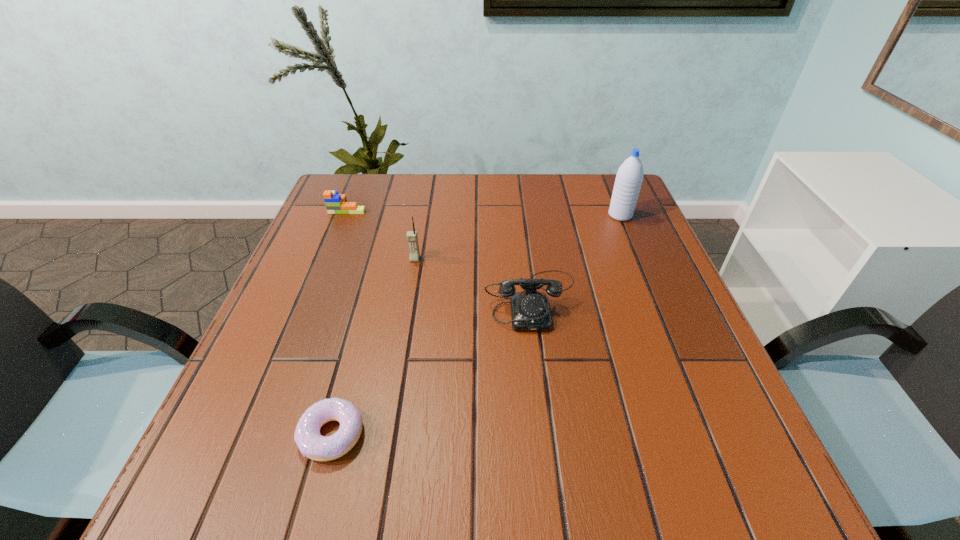
At what (x,y) coordinates should I click in order to perform the action: click on vacant space located on the left of the tallest object. Please return your answer as a coordinate pair (x, y). The image size is (960, 540). Looking at the image, I should click on (539, 215).

Identify the location of free point located on the front of the third nearest object, where the keypad is located. (392, 393).

Locate an element on the screen. This screenshot has height=540, width=960. vacant space located on the front-facing side of the third tallest object is located at coordinates (543, 403).

Where is `vacant region located on the front of the Lego`? The image size is (960, 540). vacant region located on the front of the Lego is located at coordinates (314, 293).

Where is `free space located 0.200m on the back of the second object from left to right`? The image size is (960, 540). free space located 0.200m on the back of the second object from left to right is located at coordinates (362, 321).

The height and width of the screenshot is (540, 960). Identify the location of water bottle situated at the far edge. (629, 177).

Locate an element on the screen. The height and width of the screenshot is (540, 960). Lego situated at the far edge is located at coordinates (335, 203).

At what (x,y) coordinates should I click in order to perform the action: click on object at the near edge. Please return your answer as a coordinate pair (x, y). The height and width of the screenshot is (540, 960). Looking at the image, I should click on (311, 443).

The height and width of the screenshot is (540, 960). What are the coordinates of `Lego located in the left edge section of the desktop` in the screenshot? It's located at (335, 203).

Where is `doughnut present at the left edge`? doughnut present at the left edge is located at coordinates (311, 443).